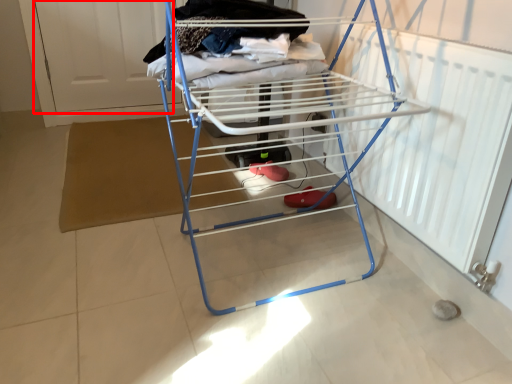
Question: In this image, where is screen door (annotated by the red box) located relative to furniture?

Choices:
 (A) left
 (B) right

Answer: (A)